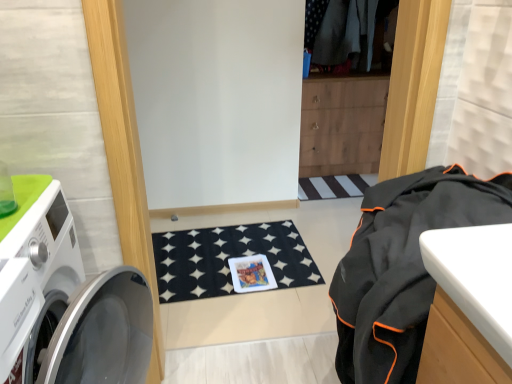
What is the approximate width of black mesh bag at right?

It is 44.40 centimeters.

Find the location of a particular element. black mesh bag at right is located at coordinates (402, 267).

This screenshot has height=384, width=512. Describe the element at coordinates (402, 267) in the screenshot. I see `black mesh bag at right` at that location.

In order to face white glossy washing machine at left, should I rotate leftwards or rightwards?

Turn left by 27.411 degrees to look at white glossy washing machine at left.

I want to click on white glossy washing machine at left, so (67, 306).

What do you see at coordinates (67, 306) in the screenshot? The image size is (512, 384). I see `white glossy washing machine at left` at bounding box center [67, 306].

In order to click on black mesh bag at right in this screenshot , I will do `click(402, 267)`.

Can you confirm if black mesh bag at right is positioned to the right of white glossy washing machine at left?

Yes.

Is black mesh bag at right further to the viewer compared to white glossy washing machine at left?

Yes, black mesh bag at right is further from the camera.

Between point (329, 294) and point (121, 370), which one is positioned behind?

Point (329, 294)

From the image's perspective, is black mesh bag at right above or below white glossy washing machine at left?

black mesh bag at right is situated higher than white glossy washing machine at left in the image.

From a real-world perspective, is black mesh bag at right positioned under white glossy washing machine at left based on gravity?

No, from a real-world perspective, black mesh bag at right is not below white glossy washing machine at left.

Between black mesh bag at right and white glossy washing machine at left, which one has smaller width?

black mesh bag at right is thinner.

Based on the photo, is black mesh bag at right taller or shorter than white glossy washing machine at left?

Considering their sizes, black mesh bag at right has less height than white glossy washing machine at left.

Which of these two, black mesh bag at right or white glossy washing machine at left, is bigger?

white glossy washing machine at left.

Is white glossy washing machine at left surrounded by black mesh bag at right?

No, white glossy washing machine at left is not inside black mesh bag at right.

Is black mesh bag at right not near white glossy washing machine at left?

No, black mesh bag at right is in close proximity to white glossy washing machine at left.

Is white glossy washing machine at left at the back of black mesh bag at right?

No, black mesh bag at right is not facing the opposite direction of white glossy washing machine at left.

How many degrees apart are the facing directions of black mesh bag at right and white glossy washing machine at left?

The facing directions of black mesh bag at right and white glossy washing machine at left are 180 degrees apart.

Locate an element on the screen. The height and width of the screenshot is (384, 512). clothing that is behind the white glossy washing machine at left is located at coordinates (402, 267).

Does white glossy washing machine at left appear on the left side of black mesh bag at right?

Yes.

Between white glossy washing machine at left and black mesh bag at right, which one is positioned behind?

black mesh bag at right.

Between point (109, 342) and point (455, 178), which one is positioned behind?

The point (109, 342) is farther.

From the image's perspective, which object appears higher, white glossy washing machine at left or black mesh bag at right?

black mesh bag at right, from the image's perspective.

In the scene shown: From a real-world perspective, who is located higher, white glossy washing machine at left or black mesh bag at right?

In real-world perspective, black mesh bag at right is above.

Considering the sizes of white glossy washing machine at left and black mesh bag at right in the image, is white glossy washing machine at left wider or thinner than black mesh bag at right?

white glossy washing machine at left is wider than black mesh bag at right.

Considering the sizes of objects white glossy washing machine at left and black mesh bag at right in the image provided, who is taller, white glossy washing machine at left or black mesh bag at right?

With more height is white glossy washing machine at left.

Between white glossy washing machine at left and black mesh bag at right, which one has smaller size?

With smaller size is black mesh bag at right.

Would you say white glossy washing machine at left is inside or outside black mesh bag at right?

white glossy washing machine at left is located beyond the bounds of black mesh bag at right.

Is white glossy washing machine at left next to black mesh bag at right and touching it?

white glossy washing machine at left and black mesh bag at right are not in contact.

Could you tell me if white glossy washing machine at left is facing black mesh bag at right?

Yes, white glossy washing machine at left is turned towards black mesh bag at right.

How much distance is there between white glossy washing machine at left and black mesh bag at right?

27.20 inches.

In the image, there is a black mesh bag at right. At what (x,y) coordinates should I click in order to perform the action: click on washing machine below it (from a real-world perspective). Please return your answer as a coordinate pair (x, y). Looking at the image, I should click on (67, 306).

Where is `clothing behind the white glossy washing machine at left`? The image size is (512, 384). clothing behind the white glossy washing machine at left is located at coordinates (402, 267).

Locate an element on the screen. This screenshot has width=512, height=384. clothing on the right of white glossy washing machine at left is located at coordinates (402, 267).